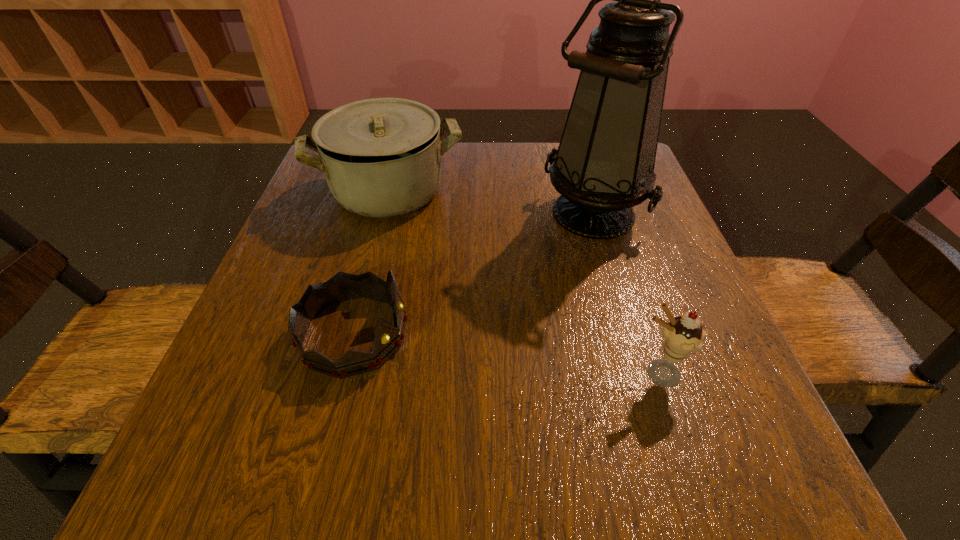
I want to click on the tallest object, so coord(604,165).

This screenshot has width=960, height=540. I want to click on saucepan, so click(x=381, y=157).

Where is `icecream`? icecream is located at coordinates 682,335.

You are a GUI agent. You are given a task and a screenshot of the screen. Output one action in this format:
    pyautogui.click(x=<x>, y=<y>)
    Task: Click on the shortest object
    The width and height of the screenshot is (960, 540).
    Given the screenshot: What is the action you would take?
    pyautogui.click(x=318, y=297)

Find the location of `free location located 0.230m on the front of the tallest object`. free location located 0.230m on the front of the tallest object is located at coordinates (631, 342).

This screenshot has height=540, width=960. What are the coordinates of `free space located 0.130m on the front of the saucepan` in the screenshot? It's located at (368, 269).

Where is `vacant space located 0.390m on the back of the icecream`? This screenshot has height=540, width=960. vacant space located 0.390m on the back of the icecream is located at coordinates (603, 208).

Identify the location of blank space located 0.190m at the front of the shortest object with jewels. This screenshot has width=960, height=540. (524, 335).

The image size is (960, 540). What are the coordinates of `oil lamp present at the far edge` in the screenshot? It's located at (604, 165).

At what (x,y) coordinates should I click in order to perform the action: click on saucepan positioned at the far edge. Please return your answer as a coordinate pair (x, y). The width and height of the screenshot is (960, 540). Looking at the image, I should click on (381, 157).